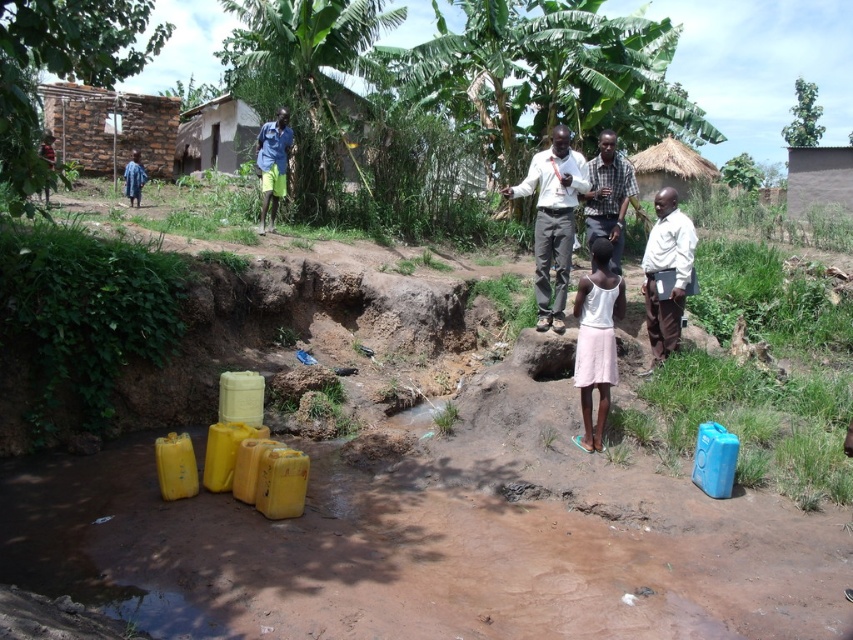
Question: Can you confirm if pink fabric skirt at center is wider than white matte shirt at center right?

Choices:
 (A) no
 (B) yes

Answer: (A)

Question: Which object appears closest to the camera in this image?

Choices:
 (A) white matte shirt at center right
 (B) white shirt at center
 (C) pink fabric skirt at center

Answer: (C)

Question: Where is white shirt at center located in relation to white matte shirt at center right in the image?

Choices:
 (A) above
 (B) below

Answer: (A)

Question: Which object is positioned closest to the white matte shirt at center right?

Choices:
 (A) checkered fabric shirt at center
 (B) pink fabric skirt at center

Answer: (A)

Question: Estimate the real-world distances between objects in this image. Which object is closer to the pink fabric skirt at center?

Choices:
 (A) white shirt at center
 (B) checkered fabric shirt at center
 (C) white matte shirt at center right

Answer: (C)

Question: In this image, where is white shirt at center located relative to white matte shirt at center right?

Choices:
 (A) above
 (B) below

Answer: (A)